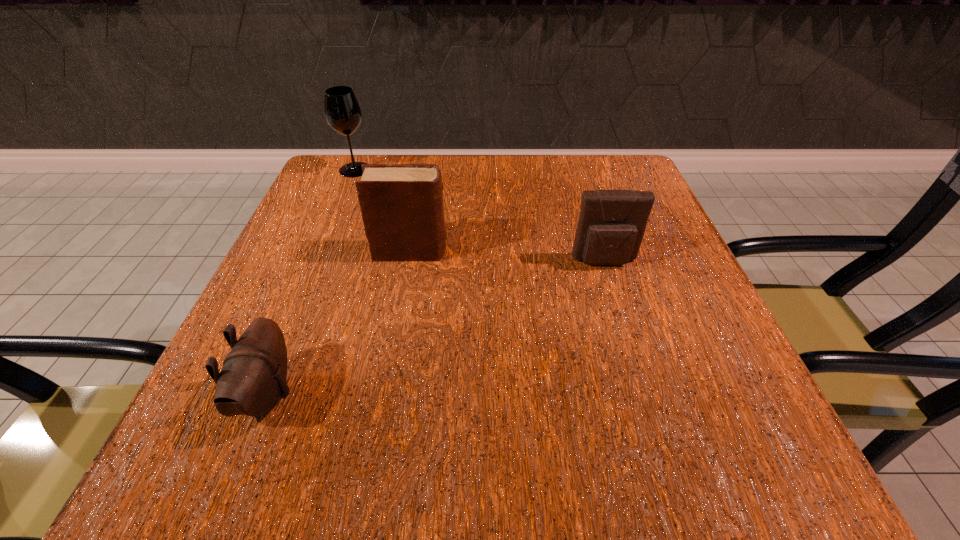
The height and width of the screenshot is (540, 960). What are the coordinates of `vacant region at the right edge` in the screenshot? It's located at (602, 267).

You are a GUI agent. You are given a task and a screenshot of the screen. Output one action in this format:
    pyautogui.click(x=<x>, y=<y>)
    Task: Click on the free space at the far left corner of the desktop
    
    Given the screenshot: What is the action you would take?
    pyautogui.click(x=384, y=158)

You are a GUI agent. You are given a task and a screenshot of the screen. Output one action in this format:
    pyautogui.click(x=<x>, y=<y>)
    Task: Click on the free space at the far right corner of the desktop
    The image size is (960, 540).
    Given the screenshot: What is the action you would take?
    pyautogui.click(x=623, y=183)

The height and width of the screenshot is (540, 960). Identify the location of vacant space at the near right corner of the desktop. (671, 442).

The height and width of the screenshot is (540, 960). In order to click on empty space that is in between the left pouch and the farther pouch in this screenshot , I will do `click(436, 328)`.

Locate an element on the screen. Image resolution: width=960 pixels, height=540 pixels. vacant space that is in between the nearest object and the farthest object is located at coordinates (311, 282).

Locate an element on the screen. Image resolution: width=960 pixels, height=540 pixels. unoccupied position between the farthest object and the third tallest object is located at coordinates (480, 215).

Locate an element on the screen. free space between the wineglass and the rightmost object is located at coordinates (480, 215).

Identify the location of empty location between the wineglass and the nearer pouch. This screenshot has width=960, height=540. (311, 282).

This screenshot has width=960, height=540. Identify the location of vacant area that lies between the shortest object and the diary. (339, 323).